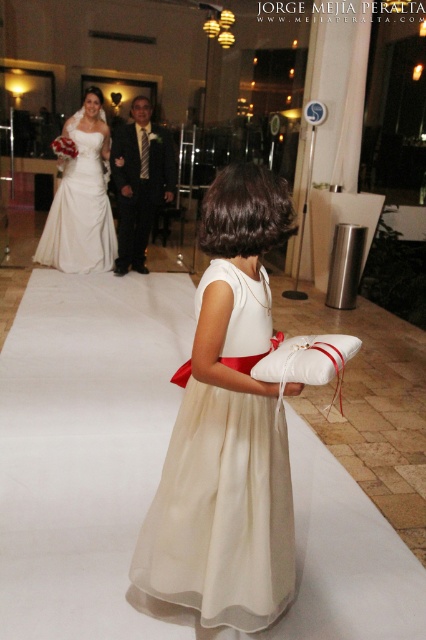
Please describe the location of the ivory satin dress at center in the image using coordinates.

The ivory satin dress at center is located at coordinates point (221, 513).

You are a photographer positioned at the origin point of the image coordinate system. You need to capture a closeup shot of the matte white dress at center. Which direction should you move your camera to focus on it?

The matte white dress at center is located at point 0.312 on the x axis and 0.192 on the y axis. Since the origin point is typically at the bottom left corner of an image coordinate system, moving the camera to the right along the x axis and slightly up along the y axis would position it to focus on the matte white dress at center.